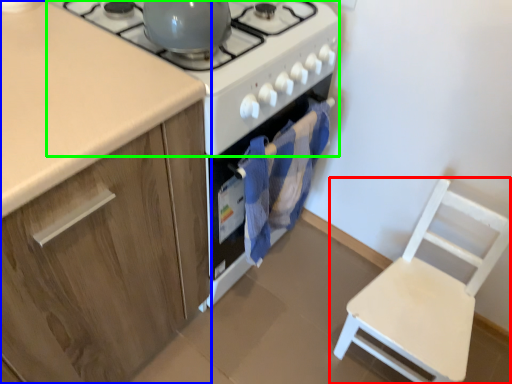
Question: Estimate the real-world distances between objects in this image. Which object is farther from chair (highlighted by a red box), cabinetry (highlighted by a blue box) or gas stove (highlighted by a green box)?

Choices:
 (A) cabinetry
 (B) gas stove

Answer: (A)